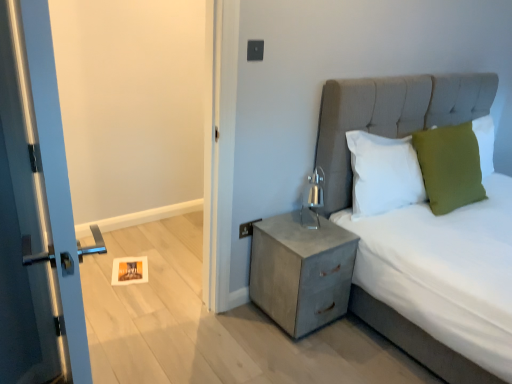
Question: From the image's perspective, is metallic silver door at left above or below green fabric pillow at upper right, the second pillow viewed from the right?

Choices:
 (A) above
 (B) below

Answer: (B)

Question: Is metallic silver door at left taller or shorter than green fabric pillow at upper right, the second pillow viewed from the right?

Choices:
 (A) short
 (B) tall

Answer: (B)

Question: Estimate the real-world distances between objects in this image. Which object is farther from the green fabric pillow at upper right, the second pillow viewed from the right?

Choices:
 (A) metallic gray nightstand at lower right
 (B) metallic gray electric outlet at upper right
 (C) white soft pillow at upper right, arranged as the 1th pillow when viewed from the left
 (D) metallic silver door at left
 (E) green fabric pillow at upper right, positioned as the third pillow in left-to-right order

Answer: (D)

Question: Based on their relative distances, which object is farther from the metallic silver door at left?

Choices:
 (A) metallic gray nightstand at lower right
 (B) metallic gray electric outlet at upper right
 (C) white soft pillow at upper right, arranged as the 1th pillow when viewed from the left
 (D) textured gray bed at center
 (E) green fabric pillow at upper right, the second pillow viewed from the right

Answer: (E)